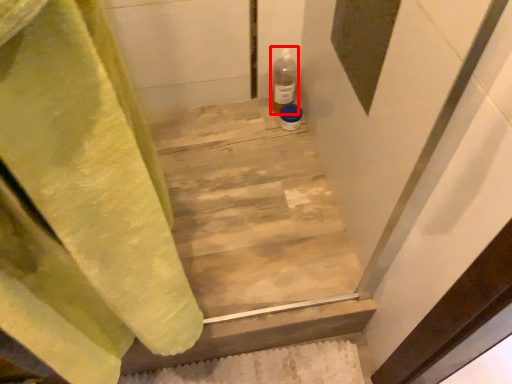
Question: From the image's perspective, where is bottle (annotated by the red box) located relative to stairwell?

Choices:
 (A) above
 (B) below

Answer: (A)